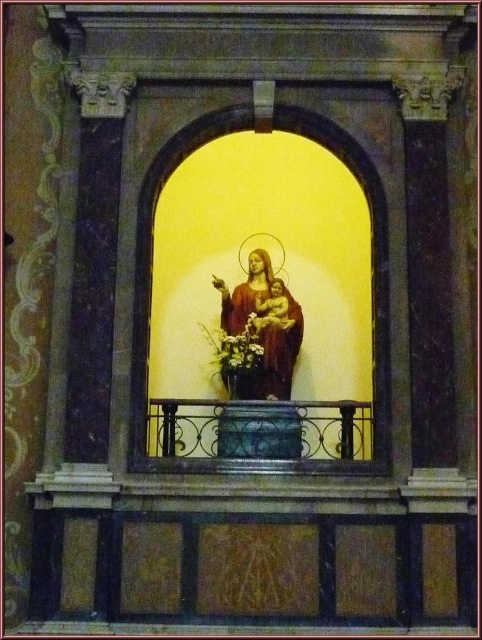
Looking at this image, you are a photographer standing in front of the religious statue. You want to take a photo that includes both points, point (190, 445) and point (237, 356). Which point will appear larger in the photo?

Point (190, 445) is closer to the camera than point (237, 356), so it will appear larger in the photo.

You are standing in front of the religious statue and want to place a small decoration on the black wrought iron balcony at center and the yellow matte flower at center. Which object allows you to place the decoration higher?

The black wrought iron balcony at center has a greater height compared to the yellow matte flower at center, so placing the decoration on the black wrought iron balcony at center allows it to be higher.

In the scene shown: You are a painter standing at the base of the statue and want to paint both the black wrought iron balcony at center and the yellow matte flower at center. Which object should you focus on first if you want to paint the wider one first?

The black wrought iron balcony at center might be wider than yellow matte flower at center, so you should focus on painting the black wrought iron balcony at center first.